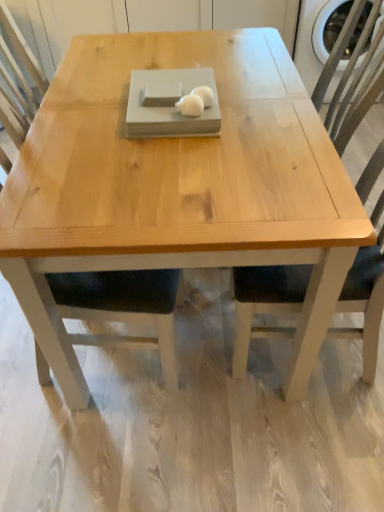
Question: From a real-world perspective, is natural wood chair at right located beneath natural wood coffee table at center?

Choices:
 (A) no
 (B) yes

Answer: (A)

Question: Considering the relative positions of natural wood chair at right and natural wood coffee table at center in the image provided, is natural wood chair at right to the right of natural wood coffee table at center from the viewer's perspective?

Choices:
 (A) yes
 (B) no

Answer: (A)

Question: Considering the relative sizes of natural wood chair at right and natural wood coffee table at center in the image provided, is natural wood chair at right wider than natural wood coffee table at center?

Choices:
 (A) no
 (B) yes

Answer: (A)

Question: Considering the relative sizes of natural wood chair at right and natural wood coffee table at center in the image provided, is natural wood chair at right smaller than natural wood coffee table at center?

Choices:
 (A) yes
 (B) no

Answer: (A)

Question: Is natural wood chair at right behind natural wood coffee table at center?

Choices:
 (A) yes
 (B) no

Answer: (B)

Question: Is natural wood coffee table at center completely or partially inside natural wood chair at right?

Choices:
 (A) yes
 (B) no

Answer: (B)

Question: Is natural wood coffee table at center bigger than white matte eggs at center, marked as the second food in a left-to-right arrangement?

Choices:
 (A) yes
 (B) no

Answer: (A)

Question: Is natural wood coffee table at center closer to camera compared to white matte eggs at center, marked as the second food in a left-to-right arrangement?

Choices:
 (A) no
 (B) yes

Answer: (A)

Question: From a real-world perspective, does natural wood coffee table at center sit lower than white matte eggs at center, marked as the second food in a left-to-right arrangement?

Choices:
 (A) yes
 (B) no

Answer: (A)

Question: Is there a large distance between natural wood coffee table at center and white matte eggs at center, marked as the second food in a left-to-right arrangement?

Choices:
 (A) no
 (B) yes

Answer: (A)

Question: Can you confirm if natural wood coffee table at center is shorter than white matte eggs at center, the first food from the right?

Choices:
 (A) yes
 (B) no

Answer: (B)

Question: Is natural wood coffee table at center located outside white matte eggs at center, the first food from the right?

Choices:
 (A) yes
 (B) no

Answer: (A)

Question: Is white matte eggs at center, the first food from the right, positioned in front of natural wood chair at right?

Choices:
 (A) no
 (B) yes

Answer: (A)